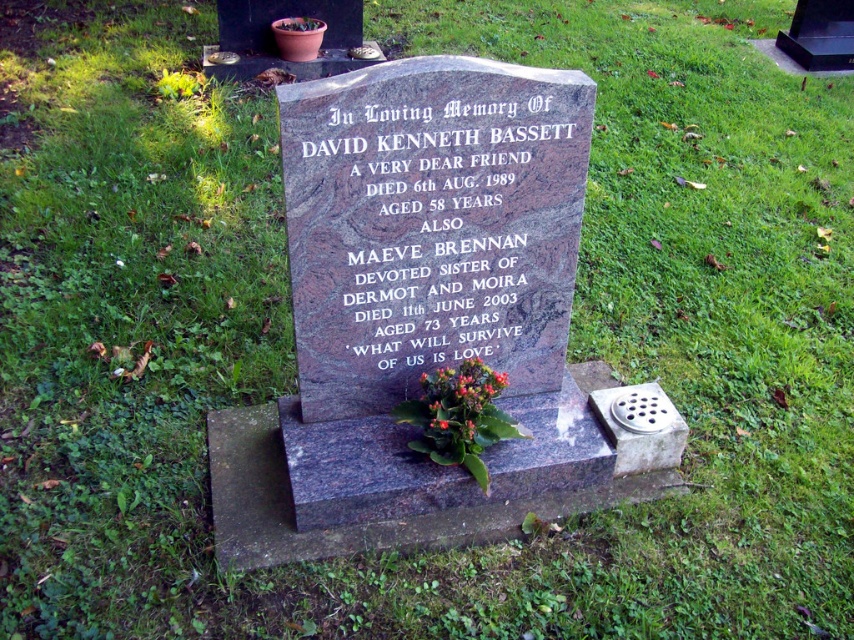
Question: Does granite gravestone at center have a lesser width compared to green leafy plant at center?

Choices:
 (A) no
 (B) yes

Answer: (A)

Question: Based on their relative distances, which object is nearer to the green leafy plant at center?

Choices:
 (A) granite gravestone at center
 (B) granite stone plaque at center

Answer: (B)

Question: Can you confirm if granite gravestone at center is positioned to the left of green leafy plant at center?

Choices:
 (A) no
 (B) yes

Answer: (B)

Question: Does granite stone plaque at center have a lesser width compared to green leafy plant at center?

Choices:
 (A) yes
 (B) no

Answer: (B)

Question: Which point is closer to the camera?

Choices:
 (A) (214, 458)
 (B) (423, 90)
 (C) (437, 390)

Answer: (B)

Question: Estimate the real-world distances between objects in this image. Which object is closer to the granite gravestone at center?

Choices:
 (A) green leafy plant at center
 (B) granite stone plaque at center

Answer: (B)